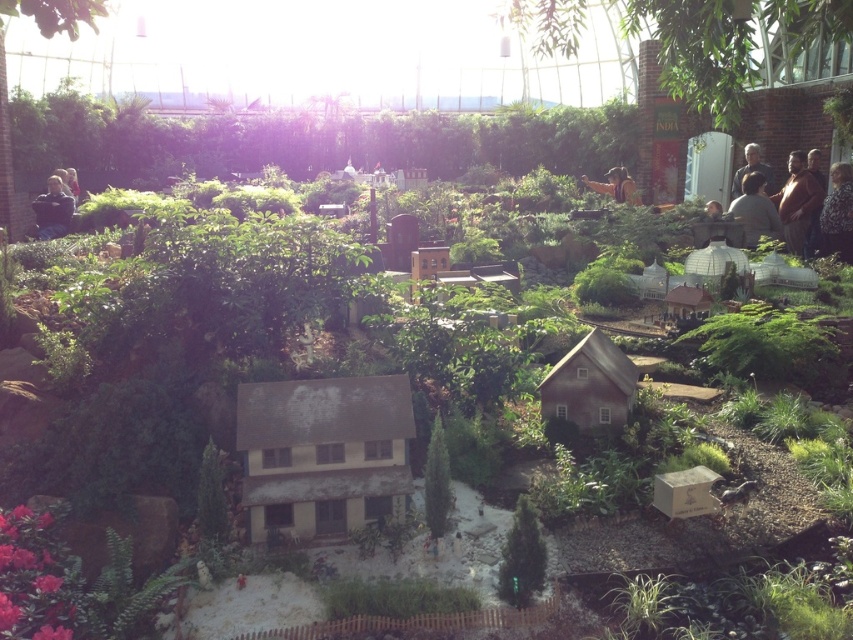
Question: Is dark blue shirt at left wider than brown leather jacket at upper center?

Choices:
 (A) yes
 (B) no

Answer: (A)

Question: Can you confirm if green leafy plants at upper center is wider than brown leather jacket at upper right?

Choices:
 (A) yes
 (B) no

Answer: (A)

Question: Which of the following is the farthest from the observer?

Choices:
 (A) (755, 195)
 (B) (737, 188)
 (C) (49, 188)

Answer: (B)

Question: Which object is the closest to the gray hair at upper right?

Choices:
 (A) dark blue shirt at left
 (B) dark gray shirt at center-right

Answer: (B)

Question: Which point is closer to the camera?

Choices:
 (A) dark gray shirt at center-right
 (B) dark blue shirt at left
 (C) brown leather jacket at upper center

Answer: (A)

Question: Does fluffy brown coat at right lie behind dark blue shirt at left?

Choices:
 (A) yes
 (B) no

Answer: (B)